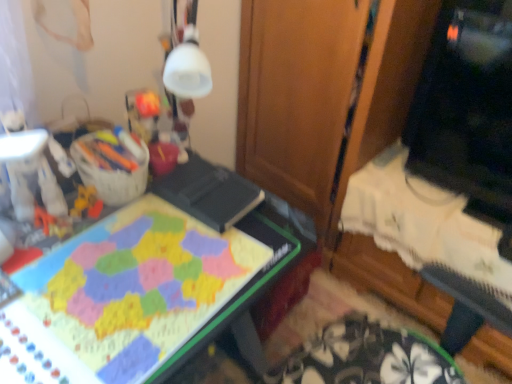
This screenshot has height=384, width=512. Find the location of `free location to the right of plush yellow toy at left`. free location to the right of plush yellow toy at left is located at coordinates (138, 228).